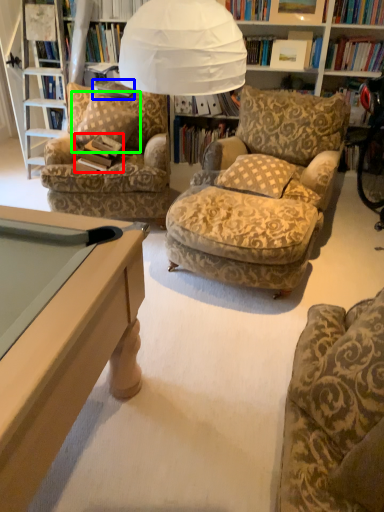
Question: Which is nearer to the book (highlighted by a red box)? book (highlighted by a blue box) or pillow (highlighted by a green box).

Choices:
 (A) book
 (B) pillow

Answer: (B)